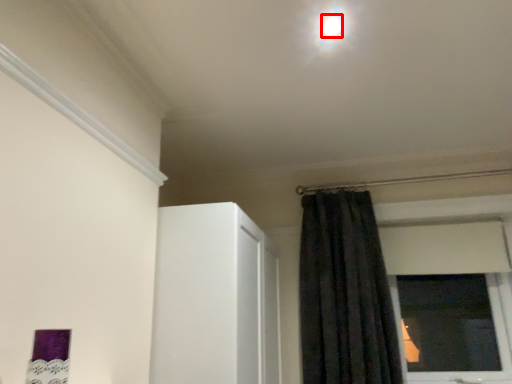
Question: In this image, where is light (annotated by the red box) located relative to curtain?

Choices:
 (A) right
 (B) left

Answer: (B)